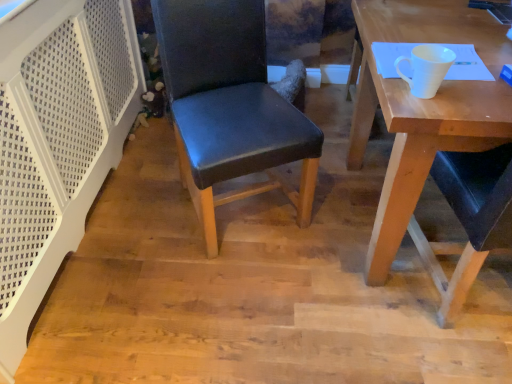
Where is `unoccupied area in front of white matte cup at upper right`? Image resolution: width=512 pixels, height=384 pixels. unoccupied area in front of white matte cup at upper right is located at coordinates (437, 110).